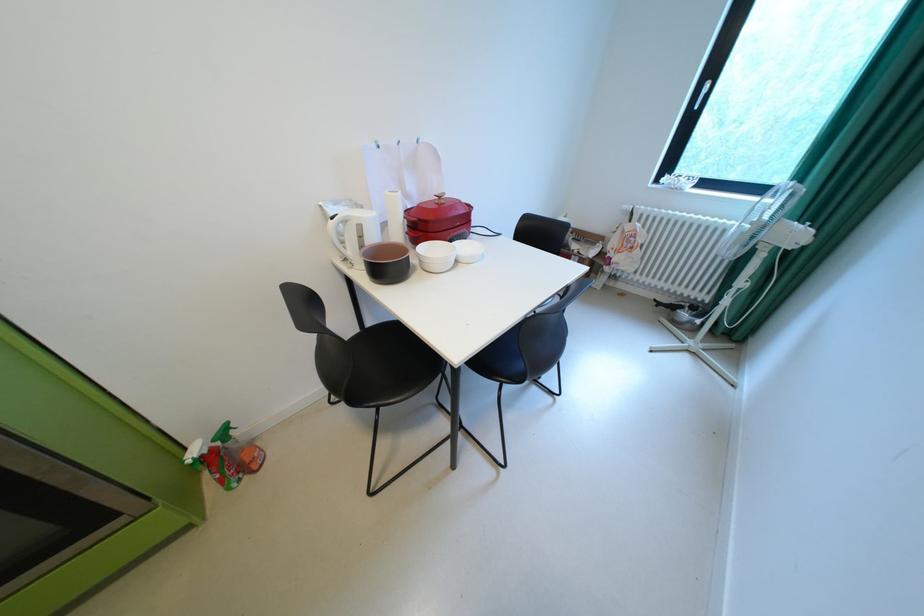
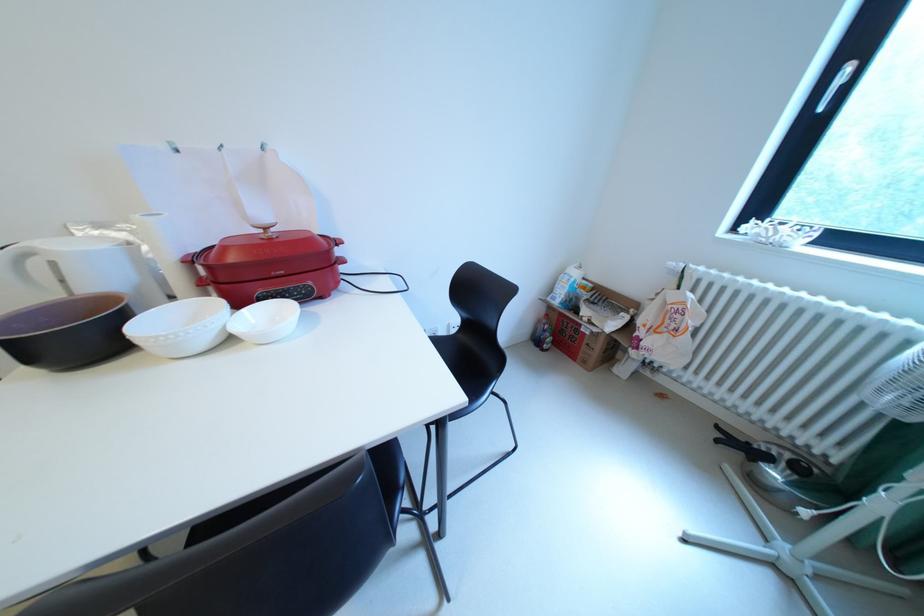
The point at (638, 228) is marked in the first image. Where is the corresponding point in the second image?

(682, 297)